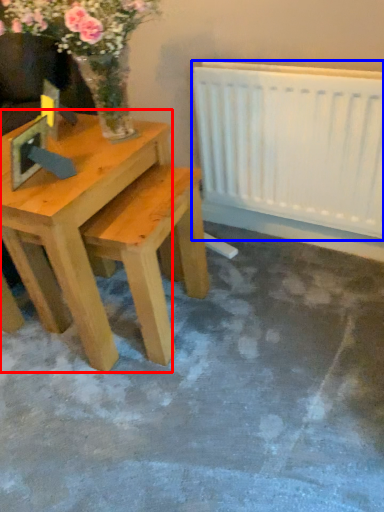
Question: Which of the following is the farthest to the observer, table (highlighted by a red box) or radiator (highlighted by a blue box)?

Choices:
 (A) table
 (B) radiator

Answer: (B)